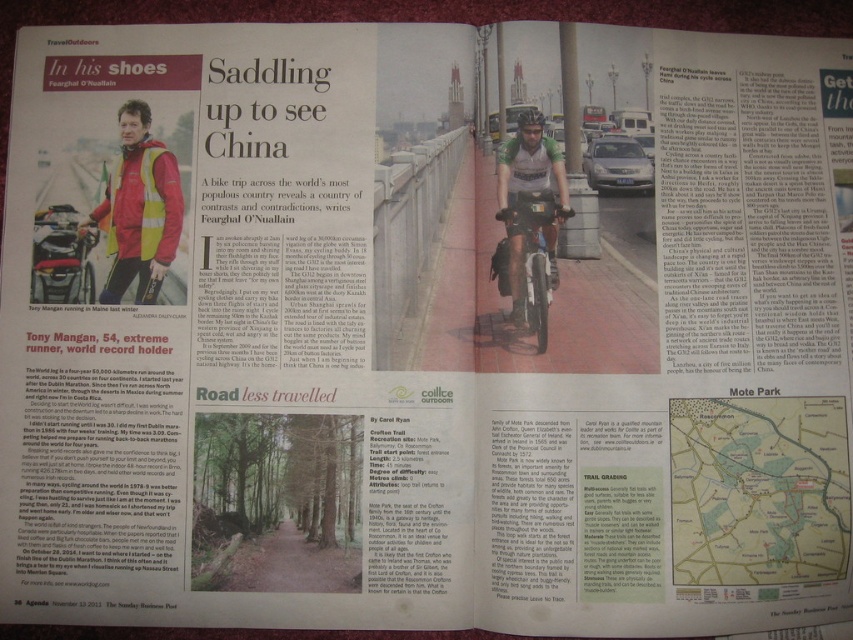
Question: Does paper map at lower right appear under shiny metallic bicycle at center?

Choices:
 (A) no
 (B) yes

Answer: (B)

Question: Which point appears farthest from the camera in this image?

Choices:
 (A) (750, 465)
 (B) (515, 227)

Answer: (B)

Question: Is paper map at lower right further to the viewer compared to shiny metallic bicycle at center?

Choices:
 (A) yes
 (B) no

Answer: (B)

Question: Which point is closer to the camera?

Choices:
 (A) (511, 289)
 (B) (804, 524)

Answer: (B)

Question: Can you confirm if paper map at lower right is positioned to the left of shiny metallic bicycle at center?

Choices:
 (A) yes
 (B) no

Answer: (B)